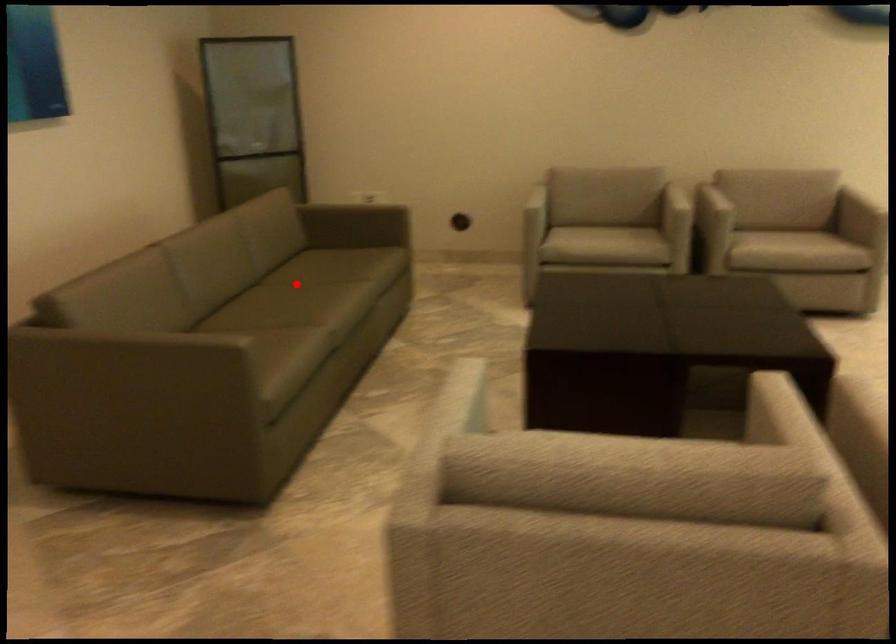
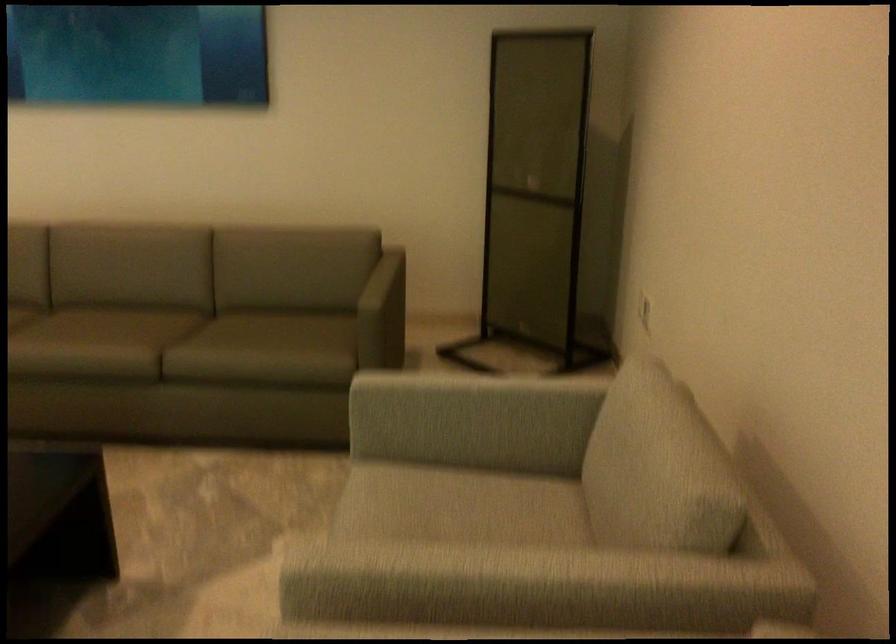
Where in the second image is the point corresponding to the highlighted location from the first image?

(128, 327)